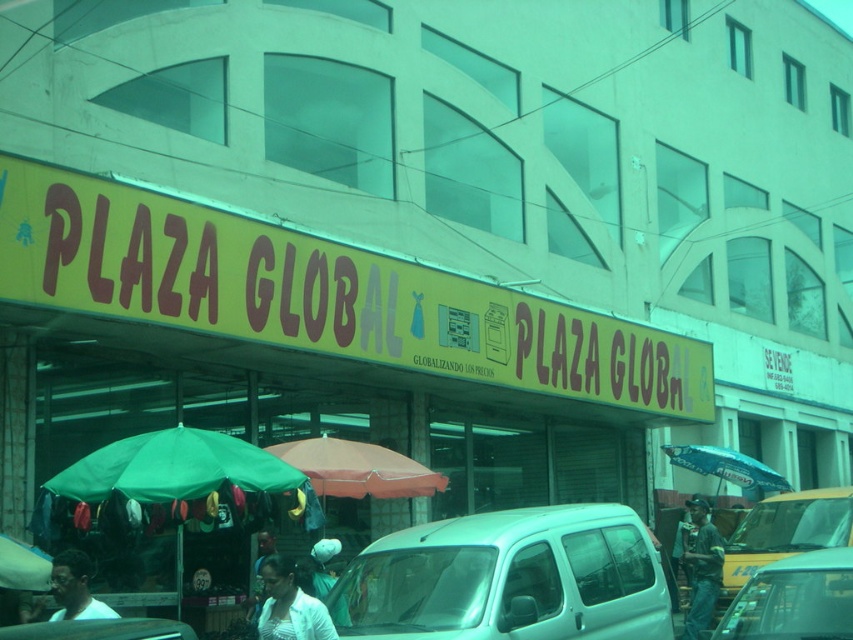
Question: Which object is closer to the camera taking this photo?

Choices:
 (A) blue fabric umbrella at center
 (B) dark skin face at lower left
 (C) white matte van at center
 (D) white fabric shirt at lower center

Answer: (B)

Question: Is metallic silver car at lower right wider than denim jacket at lower right?

Choices:
 (A) no
 (B) yes

Answer: (B)

Question: Which object is the closest to the white fabric shirt at lower center?

Choices:
 (A) metallic silver car at lower center
 (B) denim jacket at lower right
 (C) metallic silver car at lower right
 (D) yellow matte taxi at center

Answer: (A)

Question: Based on their relative distances, which object is nearer to the white fabric shirt at lower center?

Choices:
 (A) yellow matte taxi at center
 (B) green fabric umbrella at lower left
 (C) white matte van at center
 (D) dark skin face at lower left

Answer: (D)

Question: Is dark skin face at lower left wider than green fabric umbrella at lower left?

Choices:
 (A) yes
 (B) no

Answer: (B)

Question: Is yellow matte taxi at center positioned before metallic silver car at lower center?

Choices:
 (A) no
 (B) yes

Answer: (A)